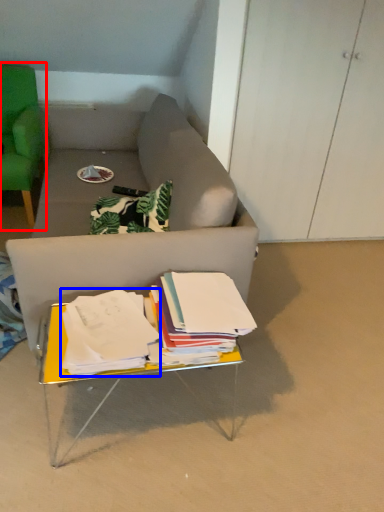
Question: Which of the following is the farthest to the observer, chair (highlighted by a red box) or paperback book (highlighted by a blue box)?

Choices:
 (A) chair
 (B) paperback book

Answer: (A)